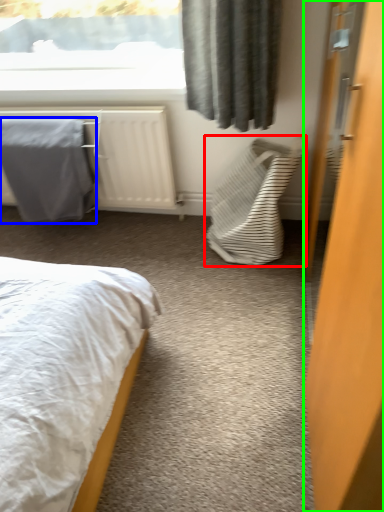
Question: Which object is positioned closest to laundry basket (highlighted by a red box)? Select from blanket (highlighted by a blue box) and door (highlighted by a green box).

Choices:
 (A) blanket
 (B) door

Answer: (A)